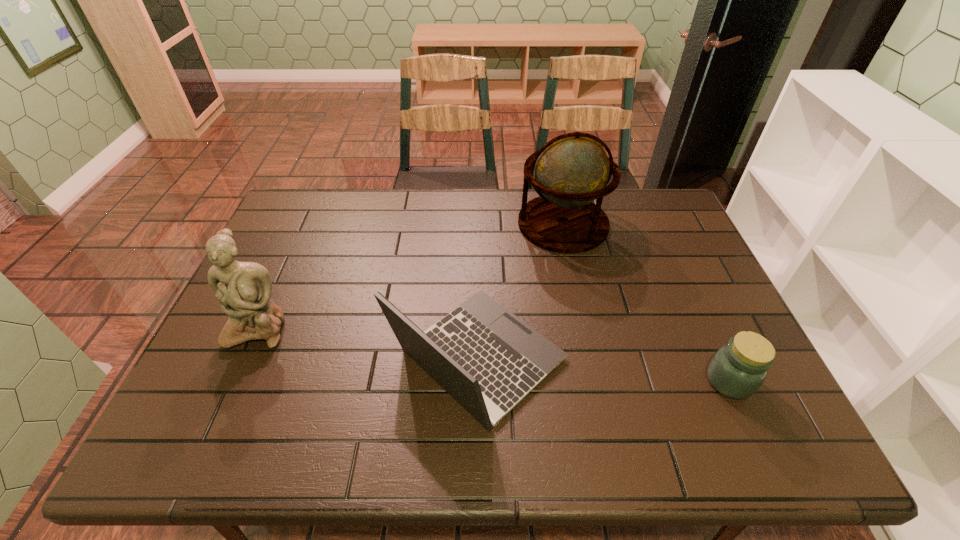
Identify the location of vacant point that satisfies the following two spatial constraints: 1. on the front-facing side of the farthest object; 2. on the left side of the rightmost object. The width and height of the screenshot is (960, 540). (596, 381).

Identify the location of vacant position in the image that satisfies the following two spatial constraints: 1. at the front screen of the second shortest object; 2. on the back side of the jar. Image resolution: width=960 pixels, height=540 pixels. (478, 381).

I want to click on vacant area that satisfies the following two spatial constraints: 1. on the front-facing side of the leftmost object; 2. on the right side of the shortest object, so click(x=234, y=381).

Find the location of `free space in the image that satisfies the following two spatial constraints: 1. on the back side of the rightmost object; 2. at the front screen of the second shortest object`. free space in the image that satisfies the following two spatial constraints: 1. on the back side of the rightmost object; 2. at the front screen of the second shortest object is located at coordinates (719, 359).

You are a GUI agent. You are given a task and a screenshot of the screen. Output one action in this format:
    pyautogui.click(x=<x>, y=<y>)
    Task: Click on the free space that satisfies the following two spatial constraints: 1. at the front screen of the second shortest object; 2. on the back side of the shortest object
    Image resolution: width=960 pixels, height=540 pixels.
    Given the screenshot: What is the action you would take?
    pyautogui.click(x=478, y=381)

Locate an element on the screen. The image size is (960, 540). blank space that satisfies the following two spatial constraints: 1. at the front screen of the shortest object; 2. on the right side of the second shortest object is located at coordinates (478, 381).

This screenshot has width=960, height=540. I want to click on blank space that satisfies the following two spatial constraints: 1. on the front-facing side of the farthest object; 2. on the front-facing side of the leftmost object, so click(x=585, y=327).

Identify the location of blank space that satisfies the following two spatial constraints: 1. on the front-facing side of the globe; 2. on the front-facing side of the leftmost object. The image size is (960, 540). (585, 327).

In order to click on vacant area in the image that satisfies the following two spatial constraints: 1. on the front-facing side of the leftmost object; 2. on the right side of the rightmost object in this screenshot , I will do [234, 381].